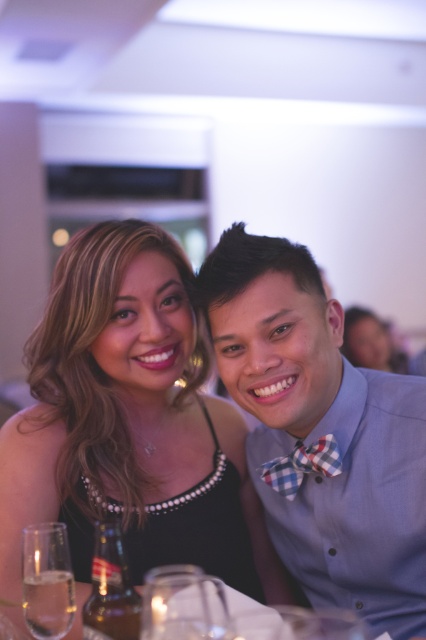
Which of these two, pearl necklace at center or checkered fabric bow tie at center, stands shorter?

checkered fabric bow tie at center is shorter.

Does pearl necklace at center have a lesser width compared to checkered fabric bow tie at center?

No, pearl necklace at center is not thinner than checkered fabric bow tie at center.

Where is `pearl necklace at center`? pearl necklace at center is located at coordinates (131, 422).

Is blue checkered bow tie at right wider than clear glass wine glass at lower center?

Yes.

Who is shorter, blue checkered bow tie at right or clear glass wine glass at lower center?

Standing shorter between the two is clear glass wine glass at lower center.

Find the location of a particular element. The width and height of the screenshot is (426, 640). blue checkered bow tie at right is located at coordinates click(322, 433).

Find the location of a particular element. This screenshot has width=426, height=640. blue checkered bow tie at right is located at coordinates (x=322, y=433).

Between pearl necklace at center and blue checkered bow tie at right, which one has more height?

pearl necklace at center

Locate an element on the screen. The image size is (426, 640). pearl necklace at center is located at coordinates (131, 422).